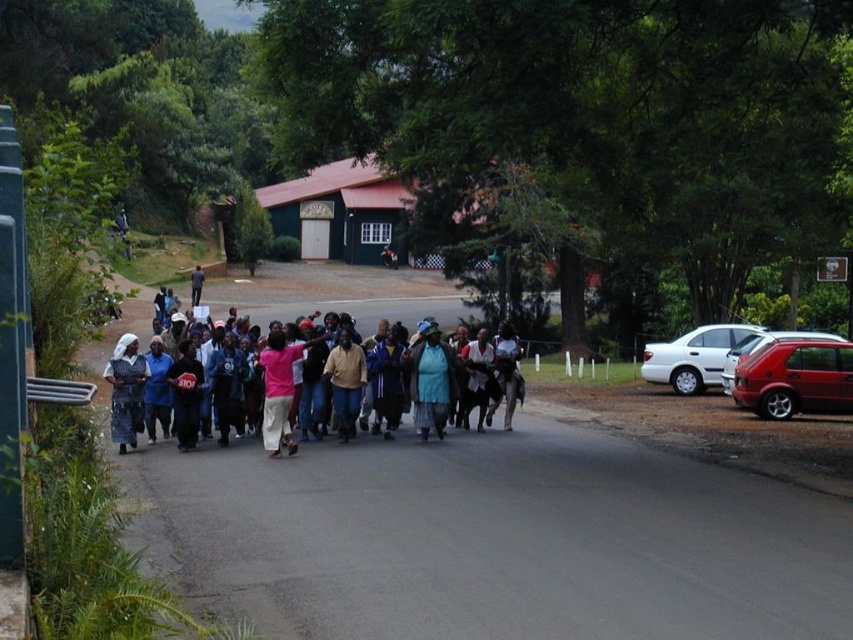
Can you confirm if white matte sedan at right is wider than pink fabric at center?

No.

Can you confirm if white matte sedan at right is taller than pink fabric at center?

No, white matte sedan at right is not taller than pink fabric at center.

In the scene shown: Who is more forward, (672, 371) or (445, 323)?

Positioned in front is point (672, 371).

Where is `white matte sedan at right`? Image resolution: width=853 pixels, height=640 pixels. white matte sedan at right is located at coordinates (693, 356).

Looking at this image, does metallic red hatchback at right have a greater height compared to pink fabric at center?

No, metallic red hatchback at right is not taller than pink fabric at center.

Is metallic red hatchback at right smaller than pink fabric at center?

Indeed, metallic red hatchback at right has a smaller size compared to pink fabric at center.

Locate an element on the screen. Image resolution: width=853 pixels, height=640 pixels. metallic red hatchback at right is located at coordinates (795, 378).

Can you confirm if metallic red hatchback at right is bigger than matte black dress at center?

Yes.

Which of these two, metallic red hatchback at right or matte black dress at center, stands shorter?

matte black dress at center

Which is behind, point (776, 364) or point (123, 438)?

The point (776, 364) is behind.

Find the location of a particular element. The height and width of the screenshot is (640, 853). metallic red hatchback at right is located at coordinates (795, 378).